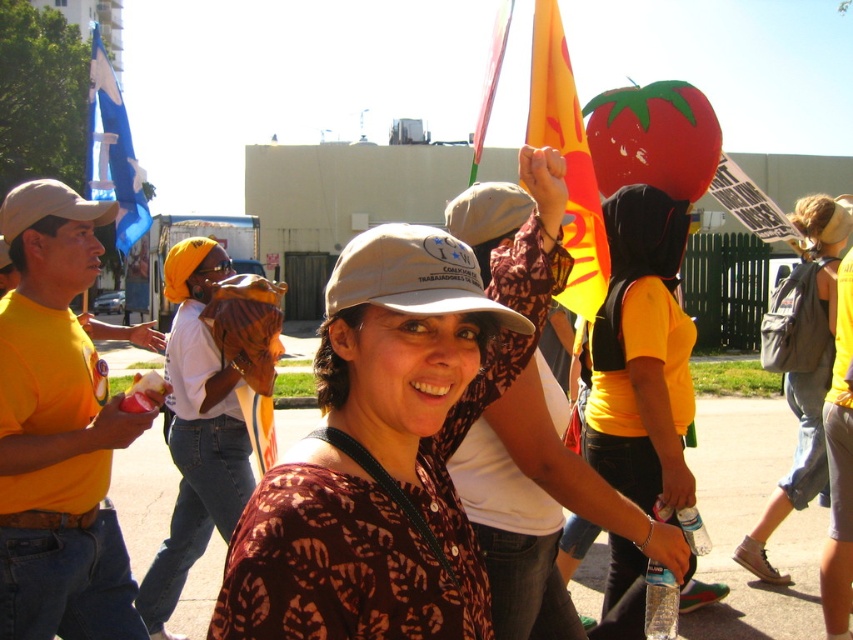
You are a photographer taking a picture of the crowd at this protest. You notice a point at coordinates (641,355) in the image. What object does this point correspond to?

The point at coordinates (641,355) corresponds to the yellow matte shirt at center.